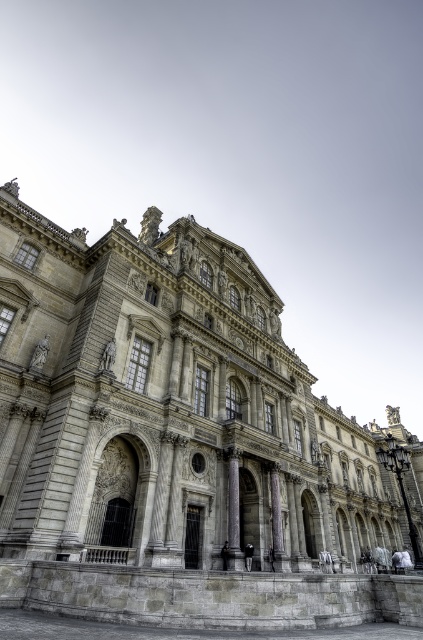
Question: Among these points, which one is nearest to the camera?

Choices:
 (A) 228,492
 (B) 136,243
 (C) 279,492

Answer: (A)

Question: Is gray stone palace at center smaller than gray stone pillar at center?

Choices:
 (A) yes
 (B) no

Answer: (B)

Question: Can you confirm if gray stone palace at center is positioned to the right of gray stone pillar at center?

Choices:
 (A) yes
 (B) no

Answer: (A)

Question: Which object is closer to the camera taking this photo?

Choices:
 (A) gray stone pillar at center
 (B) gray stone palace at center

Answer: (B)

Question: Which of the following is the closest to the observer?

Choices:
 (A) (184, 499)
 (B) (233, 483)

Answer: (A)

Question: Can you confirm if gray stone palace at center is wider than gray stone pillar at center?

Choices:
 (A) yes
 (B) no

Answer: (A)